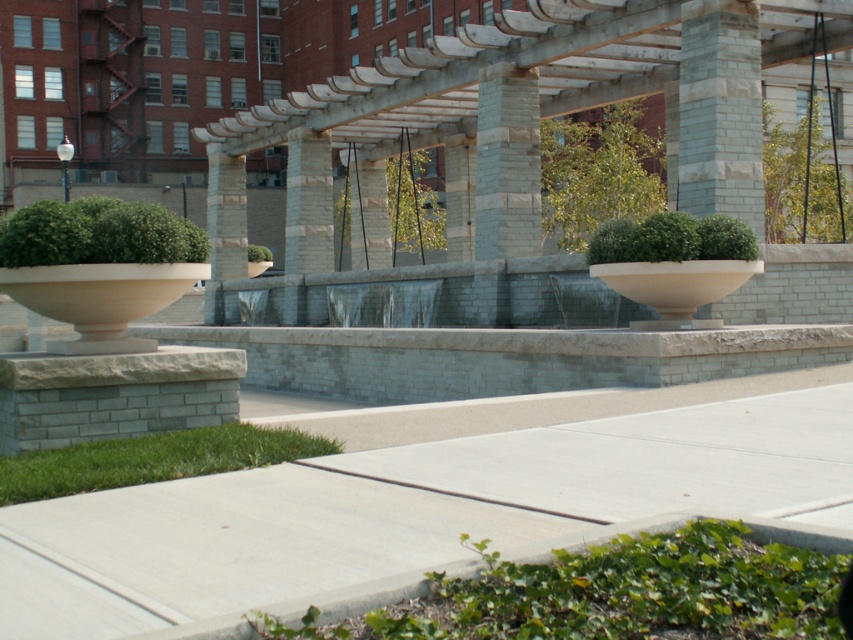
You are a landscape architect designing a new garden. You want to place a statue that is 2 meters tall in the scene. Considering the gray stone column at center, which is the closest object to the camera, will the statue appear proportionally sized when viewed from the camera position?

The gray stone column at center is 19.63 meters from the camera. A 2 meter tall statue placed at this distance would appear small in comparison to the column, but since the column itself is quite distant, the statue would need to be placed closer to the camera to maintain proportional visibility.

You are standing at the fountain and want to place a small statue between the two points, point (x=361, y=580) and point (x=216, y=195). Which point should the statue be closer to if you want it to be more visible to visitors approaching from the walkway?

The statue should be placed closer to point (x=361, y=580) because it is closer to the viewer, making it more visible to visitors approaching from the walkway.